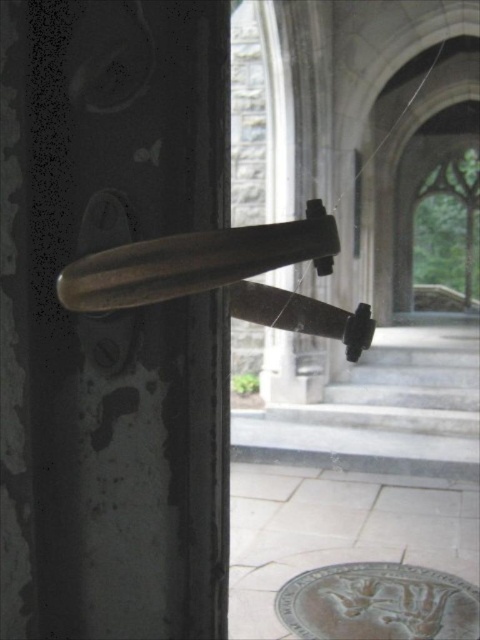
What do you see at coordinates (194, 262) in the screenshot?
I see `polished brass door handle at center` at bounding box center [194, 262].

Find the location of a particular element. This screenshot has height=640, width=480. polished brass door handle at center is located at coordinates (194, 262).

Where is `polished brass door handle at center`? The image size is (480, 640). polished brass door handle at center is located at coordinates (194, 262).

What do you see at coordinates (110, 321) in the screenshot?
I see `polished brass handle at left` at bounding box center [110, 321].

Is polished brass handle at left smaller than bronze textured medallion at lower center?

Incorrect, polished brass handle at left is not smaller in size than bronze textured medallion at lower center.

Which is behind, point (64, 595) or point (460, 612)?

Positioned behind is point (460, 612).

You are a GUI agent. You are given a task and a screenshot of the screen. Output one action in this format:
    pyautogui.click(x=<x>, y=<y>)
    Task: Click on the polished brass handle at left
    The width and height of the screenshot is (480, 640).
    Given the screenshot: What is the action you would take?
    pyautogui.click(x=110, y=321)

Can you confirm if polished brass handle at left is thinner than polished brass door handle at center?

Indeed, polished brass handle at left has a lesser width compared to polished brass door handle at center.

Does polished brass handle at left have a greater width compared to polished brass door handle at center?

No.

Between point (145, 388) and point (285, 262), which one is positioned in front?

Positioned in front is point (285, 262).

This screenshot has height=640, width=480. I want to click on polished brass handle at left, so click(110, 321).